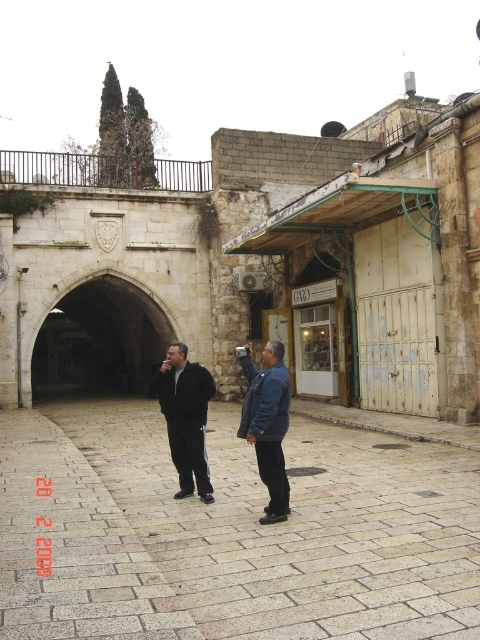
Question: Estimate the real-world distances between objects in this image. Which object is closer to the blue denim jacket at center?

Choices:
 (A) smooth stone alley at center
 (B) black matte jacket at center

Answer: (B)

Question: Can you confirm if smooth stone alley at center is positioned to the left of black matte jacket at center?

Choices:
 (A) yes
 (B) no

Answer: (B)

Question: Can you confirm if smooth stone alley at center is bigger than blue denim jacket at center?

Choices:
 (A) yes
 (B) no

Answer: (B)

Question: Estimate the real-world distances between objects in this image. Which object is farther from the black matte jacket at center?

Choices:
 (A) smooth stone alley at center
 (B) blue denim jacket at center

Answer: (A)

Question: Can you confirm if smooth stone alley at center is positioned to the left of blue denim jacket at center?

Choices:
 (A) no
 (B) yes

Answer: (B)

Question: Which object is closer to the camera taking this photo?

Choices:
 (A) blue denim jacket at center
 (B) smooth stone alley at center

Answer: (B)